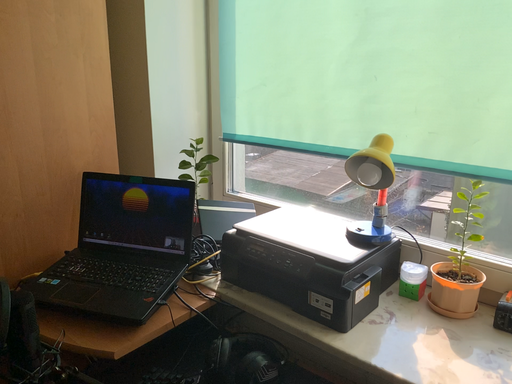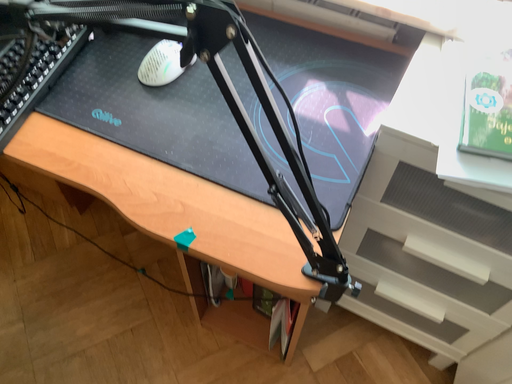
Question: Which way did the camera rotate in the video?

Choices:
 (A) rotated downward
 (B) rotated upward

Answer: (A)